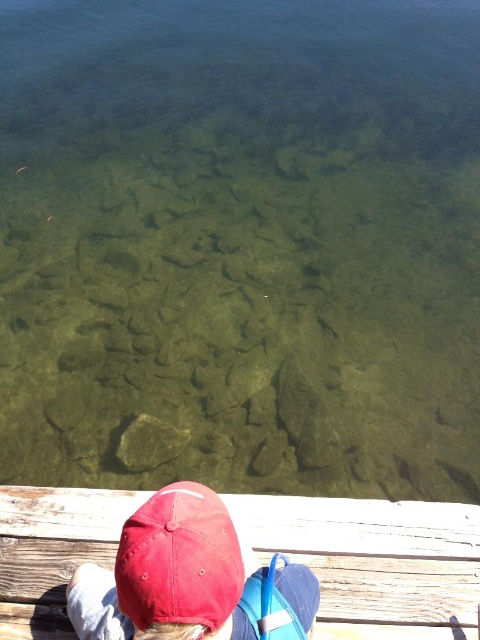
You are a drone operator trying to capture a photo of the wooden dock at lower center and the matte red baseball cap at lower left. The minimum distance your drone needs to be from the subject to take a clear photo is 1 meter. Can you take a clear photo of both subjects from the same position?

The wooden dock at lower center is 1.07 meters away from the matte red baseball cap at lower left. Since the minimum distance required is 1 meter, the drone can be positioned at a distance where both subjects are within the 1 meter requirement. Therefore, yes, you can take a clear photo of both subjects from the same position.

You are standing on the wooden dock at lower center marked by point (x=374, y=561). You want to reach the edge of the water to observe the rocks below. In which direction should you walk from the wooden dock at lower center?

The wooden dock at lower center is marked by point (x=374, y=561). Since the dock is in the foreground and the water extends towards the center, you should walk forward towards the water to reach the edge and observe the rocks below.